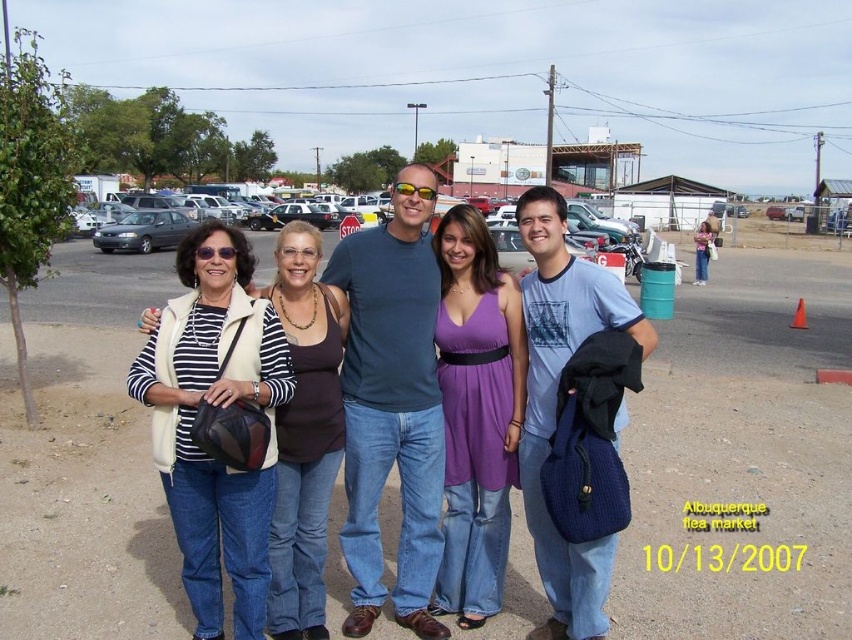
You are at the Albuquerque flea market and see the purple satin dress at center and the matte gray sedan at left. Which object is positioned closer to you?

The purple satin dress at center is closer to the viewer than the matte gray sedan at left.

You are a photographer at the Albuquerque flea market on 10th October 2007. You need to capture a photo where the matte black bag at center and the matte gray sedan at left are both visible. Based on their sizes, which object will appear larger in the photo?

The matte black bag at center will appear larger in the photo because it is taller than the matte gray sedan at left.

You are a photographer at the Albuquerque flea market and you have a camera with a 12cm lens. You want to take a photo of the matte black bag at center and the purple satin dress at center. Which object should you focus on first if you want to ensure both are in focus?

The matte black bag at center is larger than the purple satin dress at center, so focusing on the larger object first will help ensure both are in focus.